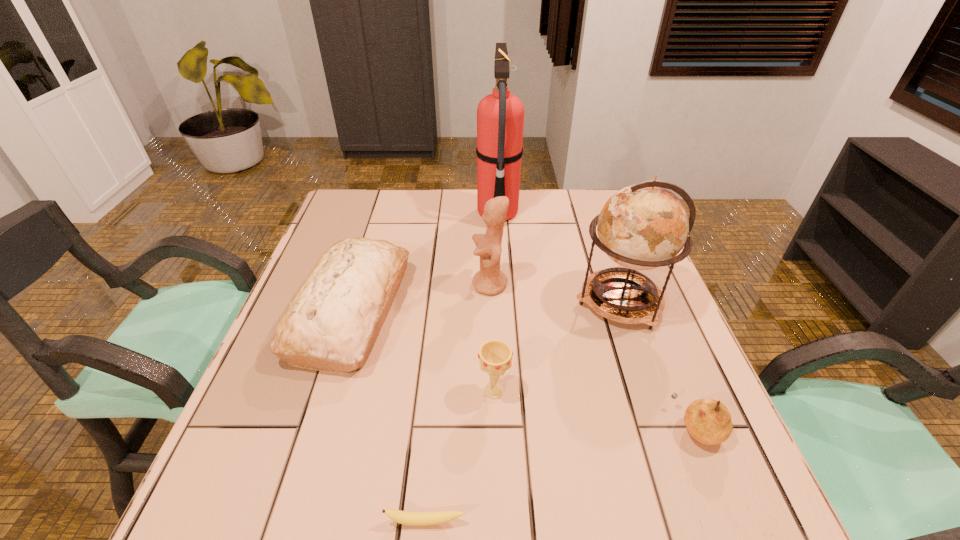
This screenshot has width=960, height=540. What are the coordinates of `vacant space located at the nozzle of the fire extinguisher` in the screenshot? It's located at pos(355,213).

At what (x,y) coordinates should I click in order to perform the action: click on vacant space situated 0.200m at the nozzle of the fire extinguisher. Please return your answer as a coordinate pair (x, y). Looking at the image, I should click on (413, 213).

Locate an element on the screen. This screenshot has height=540, width=960. vacant space situated 0.080m at the center of the second tallest object is located at coordinates (541, 301).

At what (x,y) coordinates should I click in order to perform the action: click on free space located 0.170m at the center of the second tallest object. Please return your answer as a coordinate pair (x, y). Looking at the image, I should click on (505, 301).

Locate an element on the screen. The width and height of the screenshot is (960, 540). vacant space located at the center of the second tallest object is located at coordinates (534, 301).

Identify the location of vacant area situated 0.400m on the front-facing side of the third tallest object. The height and width of the screenshot is (540, 960). (316, 285).

Identify the location of vacant space located 0.380m on the front-facing side of the third tallest object. Image resolution: width=960 pixels, height=540 pixels. (324, 285).

Find the location of a particular element. The image size is (960, 540). blank area located on the front-facing side of the third tallest object is located at coordinates (335, 285).

In order to click on free space located 0.370m on the back of the bread in this screenshot , I will do `click(389, 191)`.

Locate an element on the screen. vacant area located on the back of the chalice is located at coordinates (492, 281).